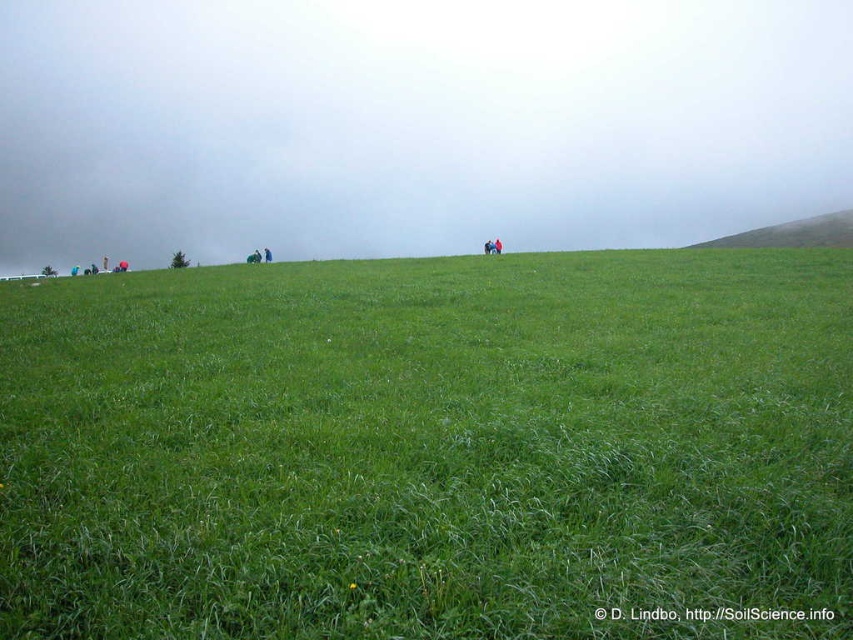
Is green grassy field at upper center wider than green grass at upper center?

Incorrect, green grassy field at upper center's width does not surpass green grass at upper center's.

The width and height of the screenshot is (853, 640). What are the coordinates of `green grassy field at upper center` in the screenshot? It's located at (430, 449).

Between point (160, 358) and point (364, 124), which one is positioned in front?

Positioned in front is point (160, 358).

The height and width of the screenshot is (640, 853). Identify the location of green grassy field at upper center. (430, 449).

Is green grass at upper center closer to camera compared to green grassy hillside at upper right?

No, green grass at upper center is behind green grassy hillside at upper right.

Find the location of `green grass at upper center`. green grass at upper center is located at coordinates (413, 124).

This screenshot has height=640, width=853. Find the location of `green grassy field at upper center`. green grassy field at upper center is located at coordinates (430, 449).

What do you see at coordinates (430, 449) in the screenshot? I see `green grassy field at upper center` at bounding box center [430, 449].

This screenshot has width=853, height=640. I want to click on green grassy field at upper center, so click(430, 449).